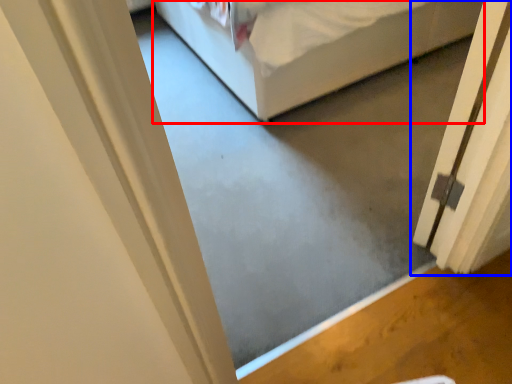
Question: Which object is further to the camera taking this photo, bed (highlighted by a red box) or door (highlighted by a blue box)?

Choices:
 (A) bed
 (B) door

Answer: (A)